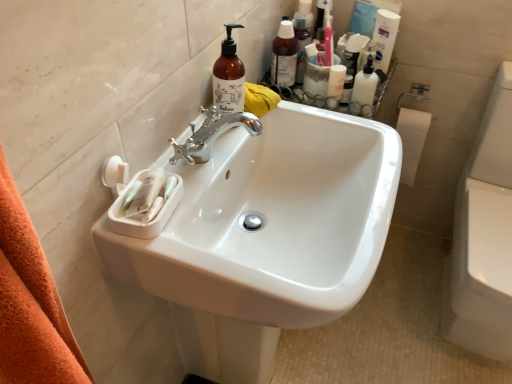
Question: Should I look upward or downward to see translucent amber bottle at upper center, which appears as the 2th cleaning product when viewed from the right?

Choices:
 (A) up
 (B) down

Answer: (A)

Question: Is white glossy toilet bowl at right at the back of white glossy sink at center?

Choices:
 (A) yes
 (B) no

Answer: (B)

Question: Does white glossy sink at center come in front of white glossy toilet bowl at right?

Choices:
 (A) yes
 (B) no

Answer: (A)

Question: From the image's perspective, does white glossy sink at center appear lower than white glossy toilet bowl at right?

Choices:
 (A) no
 (B) yes

Answer: (B)

Question: Is the position of white glossy sink at center more distant than that of white glossy toilet bowl at right?

Choices:
 (A) yes
 (B) no

Answer: (B)

Question: From the image's perspective, is white glossy sink at center located above white glossy toilet bowl at right?

Choices:
 (A) yes
 (B) no

Answer: (B)

Question: Considering the relative sizes of white glossy sink at center and white glossy toilet bowl at right in the image provided, is white glossy sink at center shorter than white glossy toilet bowl at right?

Choices:
 (A) yes
 (B) no

Answer: (B)

Question: From the image's perspective, is white glossy lotion at upper right, acting as the first toiletry starting from the right, under white glossy lotion at upper right, positioned as the 1th cleaning product in top-to-bottom order?

Choices:
 (A) yes
 (B) no

Answer: (A)

Question: Considering the relative sizes of white glossy lotion at upper right, acting as the first toiletry starting from the right, and white glossy lotion at upper right, the second cleaning product ordered from the bottom, in the image provided, is white glossy lotion at upper right, acting as the first toiletry starting from the right, smaller than white glossy lotion at upper right, the second cleaning product ordered from the bottom,?

Choices:
 (A) no
 (B) yes

Answer: (B)

Question: Does white glossy lotion at upper right, marked as the 3th toiletry in a left-to-right arrangement, have a greater width compared to white glossy lotion at upper right, the second cleaning product ordered from the bottom?

Choices:
 (A) yes
 (B) no

Answer: (A)

Question: From a real-world perspective, is white glossy lotion at upper right, marked as the 3th toiletry in a left-to-right arrangement, positioned over white glossy lotion at upper right, positioned as the 1th cleaning product in top-to-bottom order, based on gravity?

Choices:
 (A) no
 (B) yes

Answer: (A)

Question: Is white glossy lotion at upper right, acting as the first toiletry starting from the right, thinner than white glossy lotion at upper right, which ranks as the second cleaning product in left-to-right order?

Choices:
 (A) no
 (B) yes

Answer: (A)

Question: Is white glossy lotion at upper right, marked as the 3th toiletry in a left-to-right arrangement, to the left of white glossy lotion at upper right, which ranks as the 2th cleaning product in front-to-back order, from the viewer's perspective?

Choices:
 (A) yes
 (B) no

Answer: (A)

Question: Does white glossy lotion at upper right, acting as the first toiletry starting from the right, lie behind white matte jar at upper right, the second toiletry viewed from the left?

Choices:
 (A) yes
 (B) no

Answer: (B)